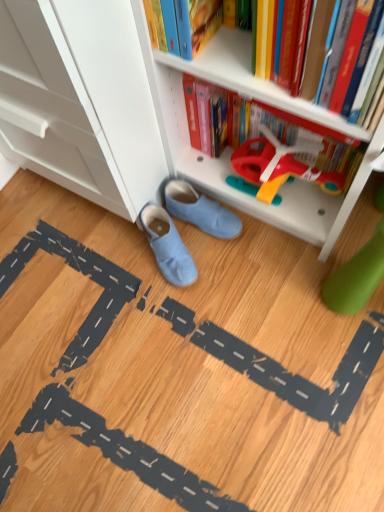
Find the location of a particular element. The height and width of the screenshot is (512, 384). suede-like blue slippers at center, the first footwear when ordered from top to bottom is located at coordinates (200, 210).

Measure the distance between light blue suede shoes at center, which ranks as the 1th footwear in bottom-to-top order, and camera.

light blue suede shoes at center, which ranks as the 1th footwear in bottom-to-top order, is 91.60 centimeters from camera.

In order to face hardcover book at upper center, should I rotate leftwards or rightwards?

Turn right approximately 10.691 degrees to face it.

Where is `suede-like blue slippers at center, the first footwear when ordered from top to bottom`? This screenshot has height=512, width=384. suede-like blue slippers at center, the first footwear when ordered from top to bottom is located at coordinates (200, 210).

Is white plastic bookcase at lower center at the left side of suede-like blue slippers at center, the first footwear when ordered from top to bottom?

In fact, white plastic bookcase at lower center is to the right of suede-like blue slippers at center, the first footwear when ordered from top to bottom.

Is white plastic bookcase at lower center thinner than suede-like blue slippers at center, the first footwear when ordered from top to bottom?

No, white plastic bookcase at lower center is not thinner than suede-like blue slippers at center, the first footwear when ordered from top to bottom.

From a real-world perspective, which is physically above, white plastic bookcase at lower center or suede-like blue slippers at center, the first footwear when ordered from top to bottom?

In real-world perspective, white plastic bookcase at lower center is above.

In the scene shown: Relative to suede-like blue slippers at center, the 2th footwear in the bottom-to-top sequence, is white plastic bookcase at lower center in front or behind?

white plastic bookcase at lower center is in front of suede-like blue slippers at center, the 2th footwear in the bottom-to-top sequence.

Is hardcover book at upper center oriented towards suede-like blue slippers at center, the first footwear when ordered from top to bottom?

No, hardcover book at upper center is not facing towards suede-like blue slippers at center, the first footwear when ordered from top to bottom.

Locate an element on the screen. This screenshot has height=512, width=384. footwear that is the 2nd object located behind the hardcover book at upper center is located at coordinates (200, 210).

Does hardcover book at upper center have a smaller size compared to suede-like blue slippers at center, the first footwear when ordered from top to bottom?

No, hardcover book at upper center is not smaller than suede-like blue slippers at center, the first footwear when ordered from top to bottom.

Considering the sizes of objects hardcover book at upper center and suede-like blue slippers at center, the 2th footwear in the bottom-to-top sequence, in the image provided, who is wider, hardcover book at upper center or suede-like blue slippers at center, the 2th footwear in the bottom-to-top sequence,?

suede-like blue slippers at center, the 2th footwear in the bottom-to-top sequence.

Is white plastic bookcase at lower center aimed at hardcover book at upper center?

Yes, white plastic bookcase at lower center is oriented towards hardcover book at upper center.

Is white plastic bookcase at lower center with hardcover book at upper center?

They are not placed beside each other.

From a real-world perspective, is white plastic bookcase at lower center on hardcover book at upper center?

No, from a real-world perspective, white plastic bookcase at lower center is not on top of hardcover book at upper center.

Which of these two, white plastic bookcase at lower center or hardcover book at upper center, is smaller?

With smaller size is hardcover book at upper center.

The width and height of the screenshot is (384, 512). What are the coordinates of `bookcase lying in front of the light blue suede shoes at center, which ranks as the 1th footwear in bottom-to-top order` in the screenshot? It's located at (140, 113).

From the picture: From the image's perspective, is white plastic bookcase at lower center on top of light blue suede shoes at center, which ranks as the 1th footwear in bottom-to-top order?

Indeed, from the image's perspective, white plastic bookcase at lower center is shown above light blue suede shoes at center, which ranks as the 1th footwear in bottom-to-top order.

Does point (140, 11) lie behind point (159, 215)?

No.

Is white plastic bookcase at lower center positioned with its back to light blue suede shoes at center, which appears as the second footwear when viewed from the top?

That's not correct — white plastic bookcase at lower center is not looking away from light blue suede shoes at center, which appears as the second footwear when viewed from the top.

Looking at their sizes, would you say hardcover book at upper center is wider or thinner than white plastic bookcase at lower center?

hardcover book at upper center is thinner than white plastic bookcase at lower center.

Is hardcover book at upper center placed right next to white plastic bookcase at lower center?

No, hardcover book at upper center is not making contact with white plastic bookcase at lower center.

How different are the orientations of hardcover book at upper center and white plastic bookcase at lower center in degrees?

0.0294 degrees.

Which of these two, suede-like blue slippers at center, the first footwear when ordered from top to bottom, or white plastic bookcase at lower center, is smaller?

suede-like blue slippers at center, the first footwear when ordered from top to bottom.

Is suede-like blue slippers at center, the first footwear when ordered from top to bottom, far away from white plastic bookcase at lower center?

They are positioned close to each other.

From a real-world perspective, which is physically above, suede-like blue slippers at center, the first footwear when ordered from top to bottom, or white plastic bookcase at lower center?

From a 3D spatial view, white plastic bookcase at lower center is above.

From a real-world perspective, is light blue suede shoes at center, which appears as the second footwear when viewed from the top, on top of hardcover book at upper center?

No, from a real-world perspective, light blue suede shoes at center, which appears as the second footwear when viewed from the top, is not above hardcover book at upper center.

How different are the orientations of light blue suede shoes at center, which appears as the second footwear when viewed from the top, and hardcover book at upper center in degrees?

56.8 degrees.

Does light blue suede shoes at center, which ranks as the 1th footwear in bottom-to-top order, turn towards hardcover book at upper center?

No, light blue suede shoes at center, which ranks as the 1th footwear in bottom-to-top order, does not turn towards hardcover book at upper center.

Considering the relative positions of light blue suede shoes at center, which appears as the second footwear when viewed from the top, and hardcover book at upper center in the image provided, is light blue suede shoes at center, which appears as the second footwear when viewed from the top, to the left or to the right of hardcover book at upper center?

light blue suede shoes at center, which appears as the second footwear when viewed from the top, is to the left of hardcover book at upper center.

From the white plastic bookcase at lower center, count 2nd footwears backward and point to it. Please provide its 2D coordinates.

[(200, 210)]

Image resolution: width=384 pixels, height=512 pixels. I want to click on book to the right of suede-like blue slippers at center, the 2th footwear in the bottom-to-top sequence, so click(255, 82).

Which object lies further to the anchor point light blue suede shoes at center, which appears as the second footwear when viewed from the top, white plastic bookcase at lower center or hardcover book at upper center?

hardcover book at upper center is positioned further to the anchor light blue suede shoes at center, which appears as the second footwear when viewed from the top.

When comparing their distances from white plastic bookcase at lower center, does hardcover book at upper center or suede-like blue slippers at center, the first footwear when ordered from top to bottom, seem closer?

Among the two, hardcover book at upper center is located nearer to white plastic bookcase at lower center.

Looking at this image, looking at the image, which one is located closer to light blue suede shoes at center, which ranks as the 1th footwear in bottom-to-top order, hardcover book at upper center or suede-like blue slippers at center, the first footwear when ordered from top to bottom?

Among the two, suede-like blue slippers at center, the first footwear when ordered from top to bottom, is located nearer to light blue suede shoes at center, which ranks as the 1th footwear in bottom-to-top order.

When comparing their distances from white plastic bookcase at lower center, does light blue suede shoes at center, which appears as the second footwear when viewed from the top, or suede-like blue slippers at center, the first footwear when ordered from top to bottom, seem further?

light blue suede shoes at center, which appears as the second footwear when viewed from the top, is positioned further to the anchor white plastic bookcase at lower center.

Consider the image. From the image, which object appears to be farther from light blue suede shoes at center, which ranks as the 1th footwear in bottom-to-top order, suede-like blue slippers at center, the 2th footwear in the bottom-to-top sequence, or hardcover book at upper center?

The object further to light blue suede shoes at center, which ranks as the 1th footwear in bottom-to-top order, is hardcover book at upper center.

Considering their positions, is light blue suede shoes at center, which ranks as the 1th footwear in bottom-to-top order, positioned further to hardcover book at upper center than white plastic bookcase at lower center?

light blue suede shoes at center, which ranks as the 1th footwear in bottom-to-top order.

From the image, which object appears to be nearer to white plastic bookcase at lower center, suede-like blue slippers at center, the 2th footwear in the bottom-to-top sequence, or hardcover book at upper center?

hardcover book at upper center is closer to white plastic bookcase at lower center.

Based on their spatial positions, is white plastic bookcase at lower center or light blue suede shoes at center, which appears as the second footwear when viewed from the top, closer to suede-like blue slippers at center, the 2th footwear in the bottom-to-top sequence?

light blue suede shoes at center, which appears as the second footwear when viewed from the top.

Identify the location of bookcase between hardcover book at upper center and suede-like blue slippers at center, the first footwear when ordered from top to bottom, from front to back. This screenshot has height=512, width=384. (140, 113).

The height and width of the screenshot is (512, 384). I want to click on bookcase between hardcover book at upper center and light blue suede shoes at center, which ranks as the 1th footwear in bottom-to-top order, from front to back, so click(x=140, y=113).

Locate an element on the screen. footwear between hardcover book at upper center and suede-like blue slippers at center, the first footwear when ordered from top to bottom, along the z-axis is located at coordinates (168, 246).

This screenshot has height=512, width=384. What are the coordinates of `footwear positioned between white plastic bookcase at lower center and suede-like blue slippers at center, the first footwear when ordered from top to bottom, from near to far` in the screenshot? It's located at (168, 246).